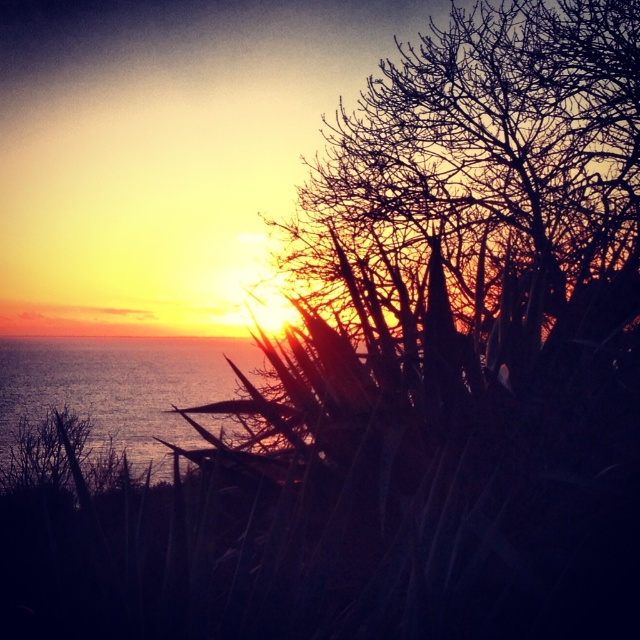
You are standing at the center of the image and want to walk towards the shiny blue water at left. Which direction should you face to avoid the bare branches at upper right?

To avoid the bare branches at upper right, you should face towards the left side of the image, as the shiny blue water at left is located to your left and the bare branches at upper right are positioned to your right.

You are a bird soaring above the serene sunset scene by the sea. You notice the bare branches at upper right and the shiny blue water at left. Which object would you see as taller from your aerial view?

The bare branches at upper right are taller than the shiny blue water at left, so from your aerial view, you would see the bare branches at upper right as taller.